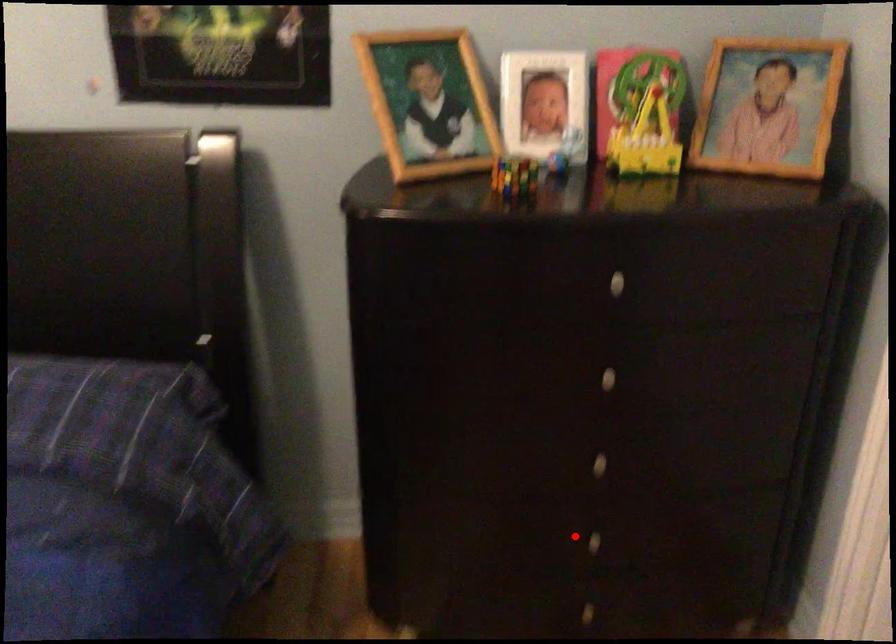
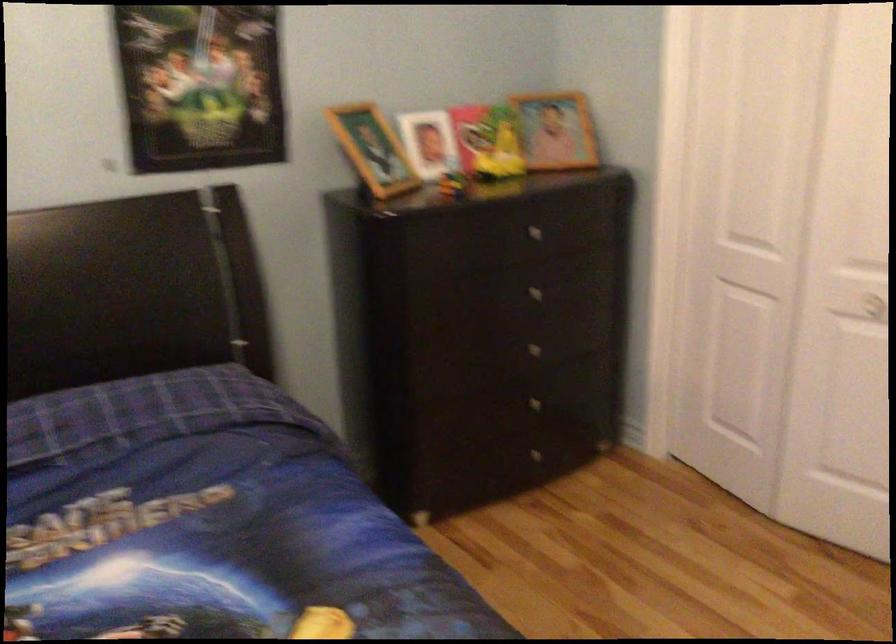
Find the pixel in the second image that matches the highlighted location in the first image.

(528, 406)